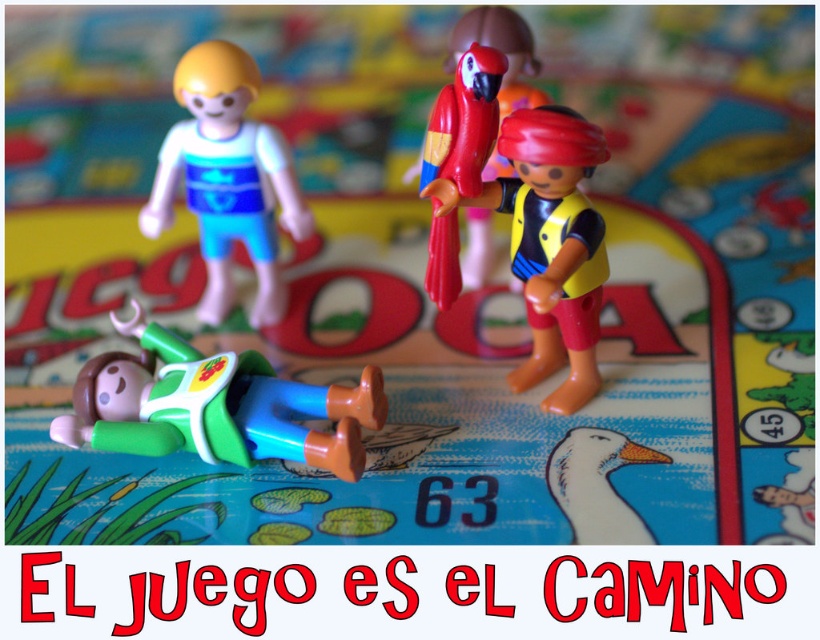
Question: Which point is closer to the camera taking this photo?

Choices:
 (A) (597, 488)
 (B) (379, 369)

Answer: (A)

Question: Where is green matte figure at lower left located in relation to white matte duck at lower center in the image?

Choices:
 (A) left
 (B) right

Answer: (A)

Question: Which object is closer to the camera taking this photo?

Choices:
 (A) matte yellow vest at center
 (B) green matte figure at lower left

Answer: (A)

Question: Is green matte figure at lower left to the left of matte blue plastic figure at upper left from the viewer's perspective?

Choices:
 (A) no
 (B) yes

Answer: (A)

Question: Considering the real-world distances, which object is farthest from the matte blue plastic figure at upper left?

Choices:
 (A) white matte duck at lower center
 (B) green matte figure at lower left

Answer: (A)

Question: Can you confirm if green matte figure at lower left is positioned below matte yellow vest at center?

Choices:
 (A) no
 (B) yes

Answer: (B)